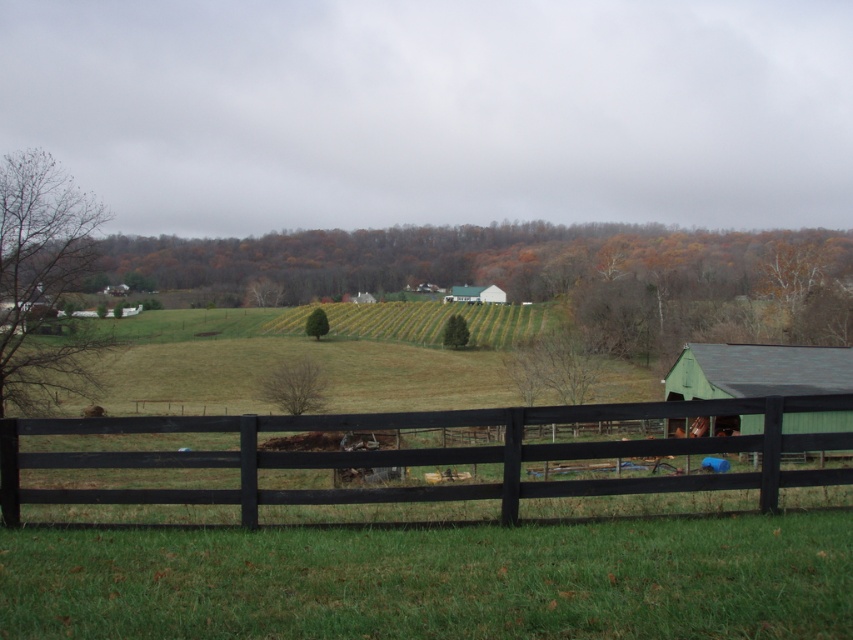
You are standing in the rural landscape scene and want to cross the black wood fence at lower center. The point at coordinates point (422, 456) marks the location of the fence. Is there enough space between the fence and the field beyond it to walk through comfortably?

The black wood fence at lower center is represented by point (422, 456). Since the fence is part of the scene and there is an open field beyond it, there should be sufficient space to walk through comfortably between the fence and the field.

You are standing in the rural landscape and want to walk to the green matte barn at right. Which direction should you move relative to the black wood fence at lower center?

You should move to the right side of the black wood fence at lower center to reach the green matte barn at right since the black wood fence at lower center is positioned on the left side of the green matte barn at right.

You are a farmer who wants to paint both the black wood fence at lower center and the white matte barn at center. If you have enough paint for only one of them, which one should you choose based on their sizes?

The black wood fence at lower center has a larger size compared to the white matte barn at center, so you should choose to paint the black wood fence at lower center first.